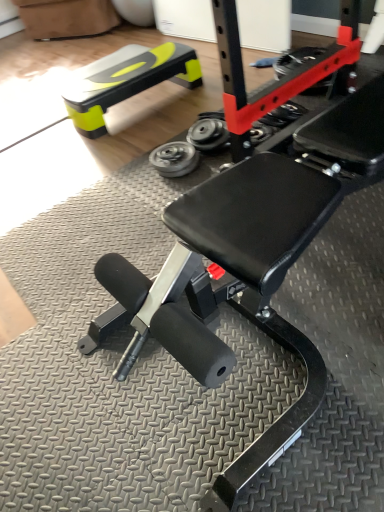
Question: Considering the positions of metallic gray wheel at center, the 1th wheel positioned from the right, and metallic silver wheel at center, placed as the first wheel when sorted from left to right, in the image, is metallic gray wheel at center, the 1th wheel positioned from the right, wider or thinner than metallic silver wheel at center, placed as the first wheel when sorted from left to right,?

Choices:
 (A) wide
 (B) thin

Answer: (B)

Question: Visually, is metallic gray wheel at center, the 2th wheel viewed from the left, positioned to the left or to the right of metallic silver wheel at center, placed as the first wheel when sorted from left to right?

Choices:
 (A) right
 (B) left

Answer: (A)

Question: Estimate the real-world distances between objects in this image. Which object is farther from the neon yellow plastic bench at upper left?

Choices:
 (A) metallic gray wheel at center, the 2th wheel viewed from the left
 (B) rubber/soft tire at center
 (C) metallic silver wheel at center, placed as the first wheel when sorted from left to right

Answer: (B)

Question: Estimate the real-world distances between objects in this image. Which object is farther from the metallic gray wheel at center, the 1th wheel positioned from the right?

Choices:
 (A) neon yellow plastic bench at upper left
 (B) rubber/soft tire at center
 (C) metallic silver wheel at center, which is the 2th wheel from right to left

Answer: (B)